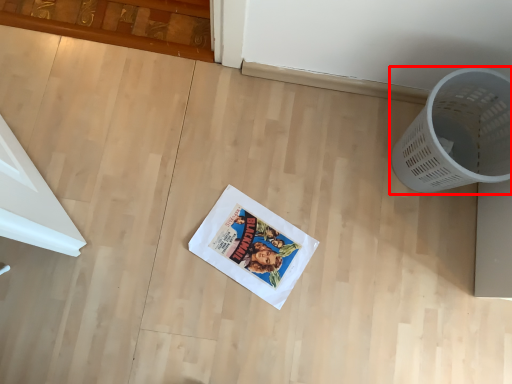
Question: From the image, what is the correct spatial relationship of waste container (annotated by the red box) in relation to comic book?

Choices:
 (A) left
 (B) right

Answer: (B)